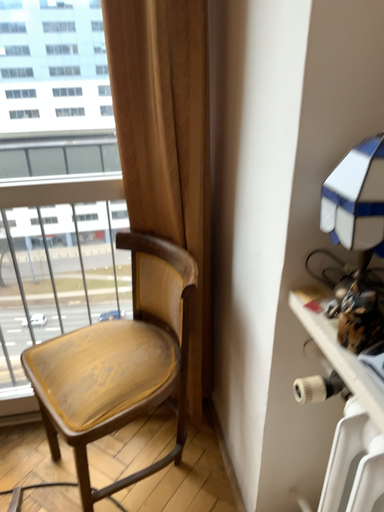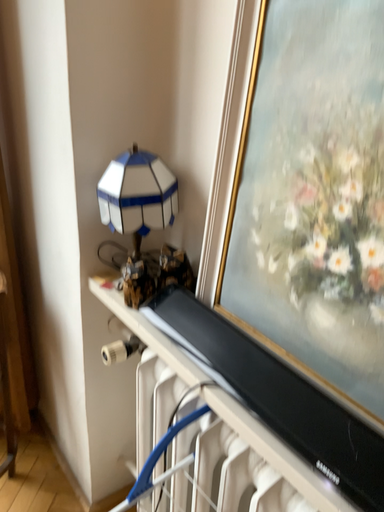
Question: Which way did the camera rotate in the video?

Choices:
 (A) rotated left
 (B) rotated right

Answer: (B)